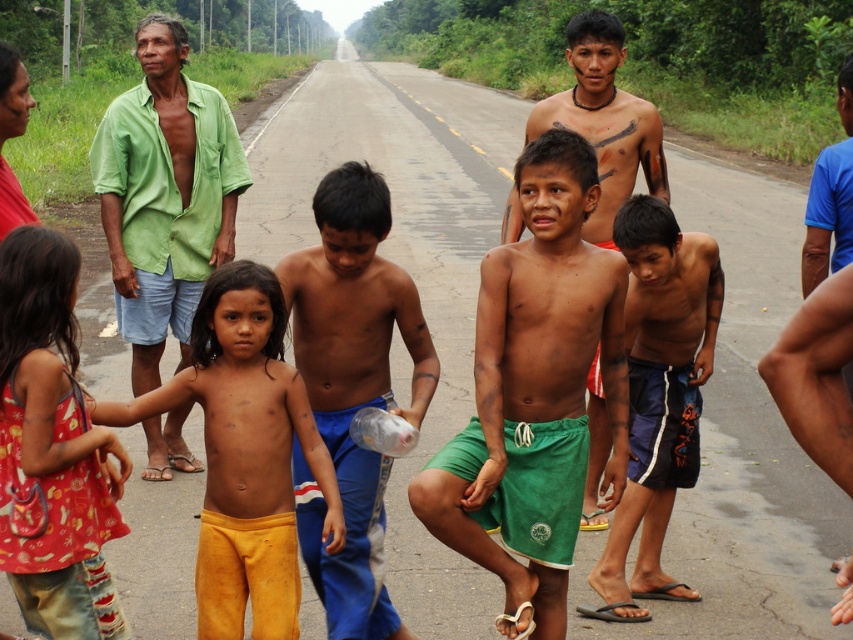
Does yellow cotton pants at center appear on the right side of shiny plastic bottle at center?

No, yellow cotton pants at center is not to the right of shiny plastic bottle at center.

Can you confirm if yellow cotton pants at center is shorter than shiny plastic bottle at center?

Yes, yellow cotton pants at center is shorter than shiny plastic bottle at center.

Does point (242, 547) come farther from viewer compared to point (404, 627)?

That is False.

Find the location of a particular element. Image resolution: width=853 pixels, height=640 pixels. yellow cotton pants at center is located at coordinates (244, 454).

Who is lower down, green cotton shorts at center or shiny skin boy at center?

green cotton shorts at center is below.

Does green cotton shorts at center have a larger size compared to shiny skin boy at center?

Incorrect, green cotton shorts at center is not larger than shiny skin boy at center.

Where is `green cotton shorts at center`? The height and width of the screenshot is (640, 853). green cotton shorts at center is located at coordinates (534, 394).

Can you confirm if green cotton shorts at center is positioned below yellow cotton pants at center?

Incorrect, green cotton shorts at center is not positioned below yellow cotton pants at center.

Does green cotton shorts at center have a lesser height compared to yellow cotton pants at center?

Incorrect, green cotton shorts at center's height does not fall short of yellow cotton pants at center's.

Between point (624, 404) and point (299, 381), which one is positioned in front?

Point (299, 381) is in front.

The height and width of the screenshot is (640, 853). Find the location of `green cotton shorts at center`. green cotton shorts at center is located at coordinates (534, 394).